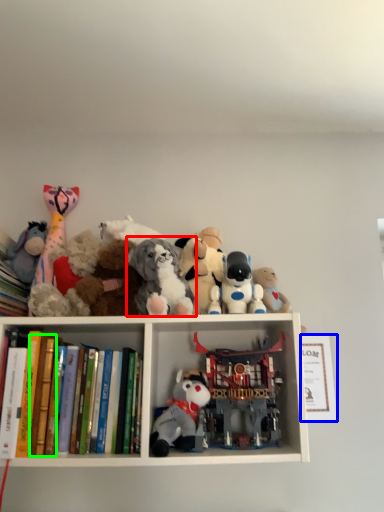
Question: Which object is positioned farthest from toy (highlighted by a red box)? Select from paperback book (highlighted by a blue box) and paperback book (highlighted by a green box).

Choices:
 (A) paperback book
 (B) paperback book

Answer: (A)